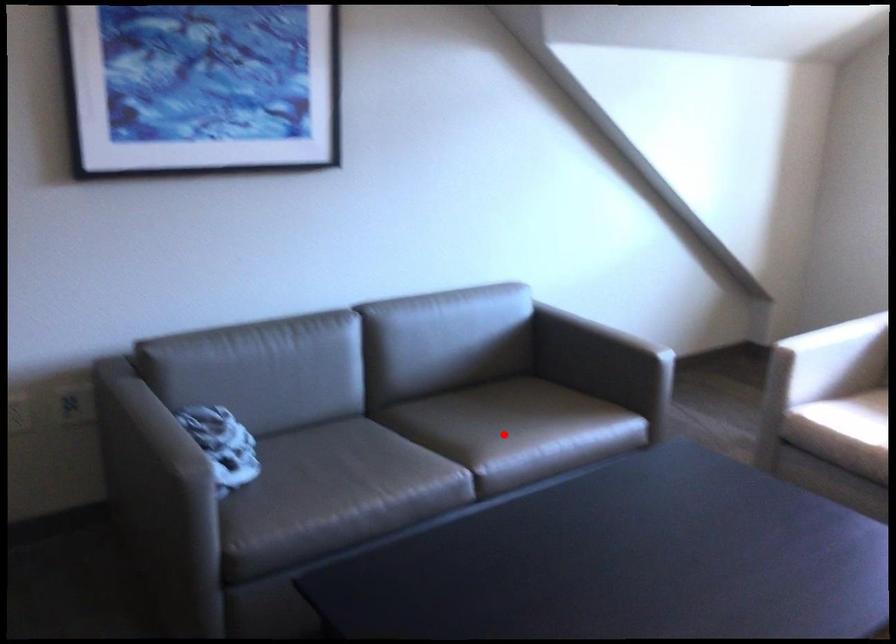
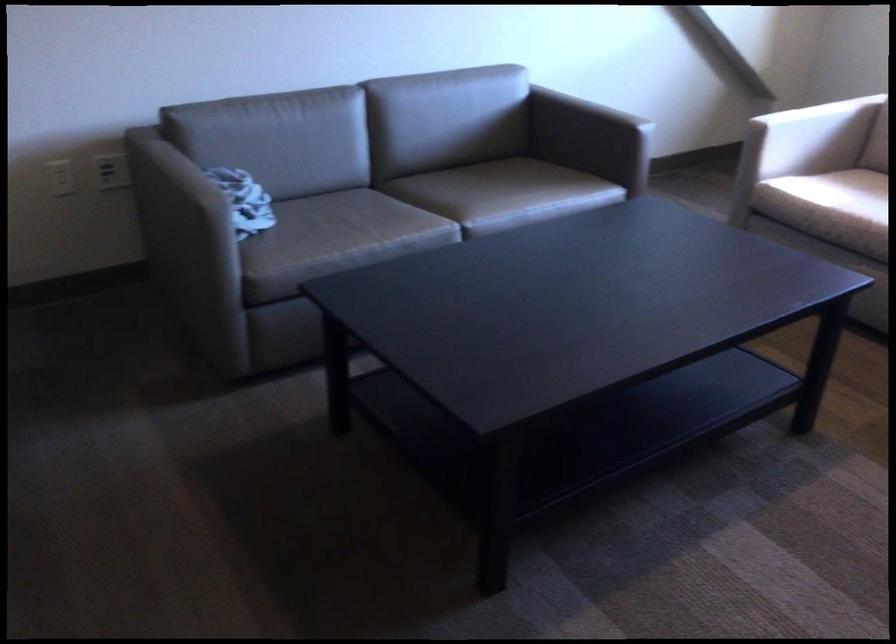
Question: I am providing you with two images of the same scene from different viewpoints. A red point is shown in image1. For the corresponding object point in image2, is it positioned nearer or farther from the camera?

Choices:
 (A) Nearer
 (B) Farther

Answer: (B)